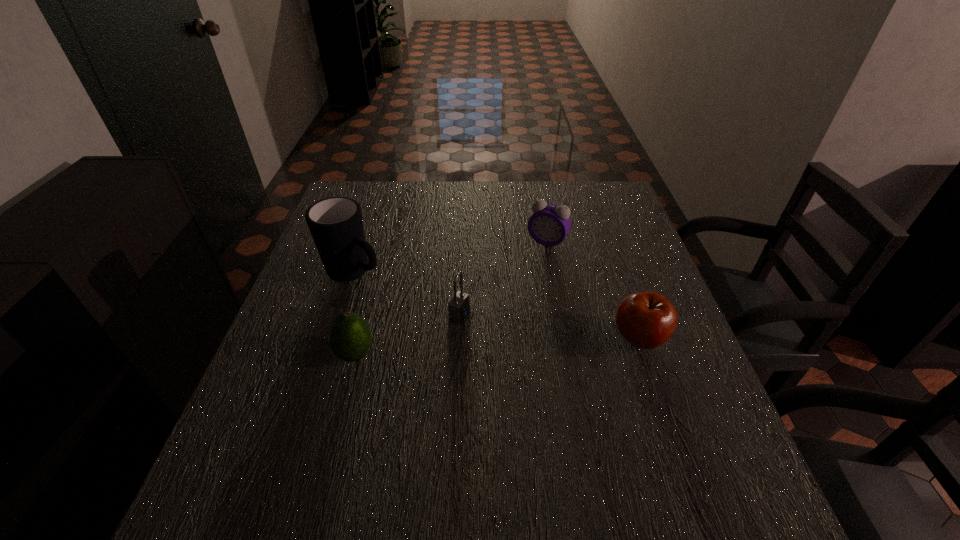
I want to click on vacant space on the desktop that is between the avocado and the apple and is positioned on the side of the mug with the handle, so click(484, 348).

The height and width of the screenshot is (540, 960). In order to click on free spot on the desktop that is between the avocado and the apple and is positioned on the face of the farthest object in this screenshot , I will do `click(483, 348)`.

Locate an element on the screen. Image resolution: width=960 pixels, height=540 pixels. vacant space on the desktop that is between the avocado and the apple and is positioned on the shackle of the third object from left to right is located at coordinates (540, 345).